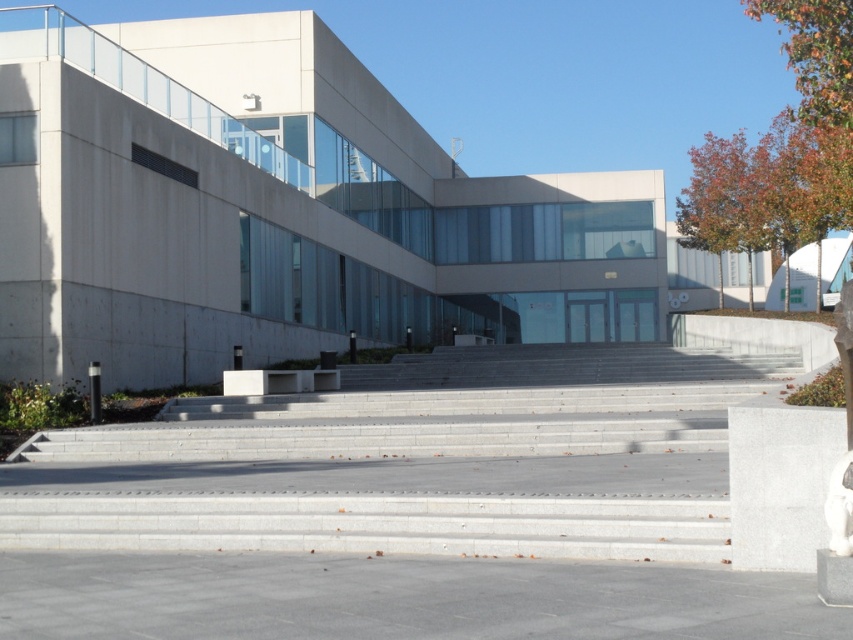
Question: Is autumn leaves at upper right above orange leafy tree at upper right?

Choices:
 (A) no
 (B) yes

Answer: (A)

Question: Can you confirm if gray concrete stairs at center is positioned above orange leafy tree at upper right?

Choices:
 (A) yes
 (B) no

Answer: (B)

Question: Which object appears farthest from the camera in this image?

Choices:
 (A) white granite block at center
 (B) orange leafy tree at upper right
 (C) gray concrete stairs at center
 (D) autumn leaves at upper right

Answer: (D)

Question: Estimate the real-world distances between objects in this image. Which object is closer to the white granite block at center?

Choices:
 (A) autumn leaves at upper right
 (B) orange leafy tree at upper right
 (C) gray concrete stairs at center

Answer: (C)

Question: Can you confirm if autumn leaves at upper right is thinner than white granite block at center?

Choices:
 (A) no
 (B) yes

Answer: (A)

Question: Which point is closer to the camera?

Choices:
 (A) orange leafy tree at upper right
 (B) autumn leaves at upper right
 (C) white granite block at center
 (D) gray concrete stairs at center

Answer: (C)